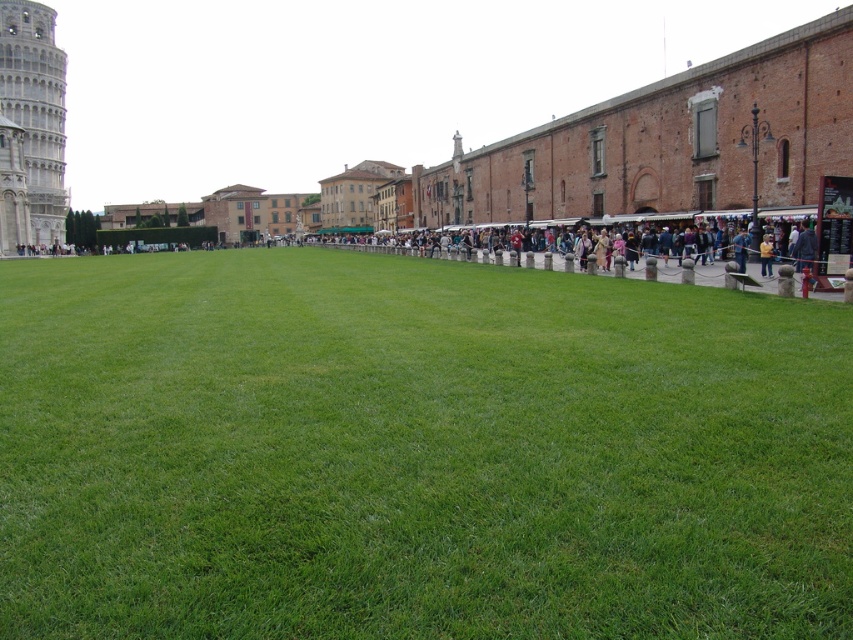
Question: Does green grass at center have a greater width compared to white stone tower at left?

Choices:
 (A) no
 (B) yes

Answer: (B)

Question: In this image, where is green grass at center located relative to white stone tower at left?

Choices:
 (A) below
 (B) above

Answer: (A)

Question: Among these points, which one is nearest to the camera?

Choices:
 (A) (4, 52)
 (B) (753, 540)

Answer: (B)

Question: Can you confirm if green grass at center is positioned to the right of white stone tower at left?

Choices:
 (A) no
 (B) yes

Answer: (B)